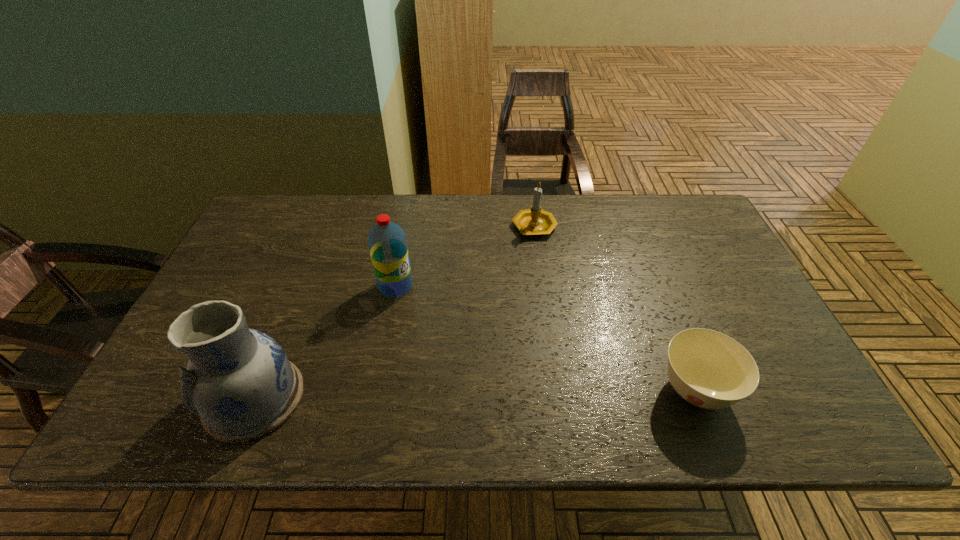
Locate an element on the screen. The width and height of the screenshot is (960, 540). free spot located with a handle on the second shortest object is located at coordinates (529, 267).

The height and width of the screenshot is (540, 960). Find the location of `vacant region located 0.180m with a handle on the second shortest object`. vacant region located 0.180m with a handle on the second shortest object is located at coordinates (527, 285).

The width and height of the screenshot is (960, 540). Identify the location of vacant area located on the front label of the third object from right to left. (440, 321).

The height and width of the screenshot is (540, 960). Identify the location of vacant position located on the front label of the third object from right to left. (450, 329).

Identify the location of vacant area situated 0.330m on the front label of the third object from right to left. (498, 367).

The image size is (960, 540). In order to click on object present at the far edge in this screenshot , I will do `click(534, 221)`.

Locate an element on the screen. pottery located at the near edge is located at coordinates (240, 382).

You are a GUI agent. You are given a task and a screenshot of the screen. Output one action in this format:
    pyautogui.click(x=<x>, y=<y>)
    Task: Click on the sugar bowl present at the near edge
    Image resolution: width=960 pixels, height=540 pixels.
    Given the screenshot: What is the action you would take?
    pyautogui.click(x=708, y=369)

Where is `object at the left edge`? object at the left edge is located at coordinates (240, 382).

Image resolution: width=960 pixels, height=540 pixels. Find the location of `object at the right edge`. object at the right edge is located at coordinates (708, 369).